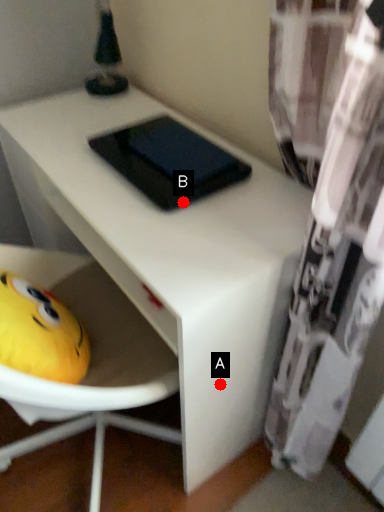
Question: Two points are circled on the image, labeled by A and B beside each circle. Which of the following is the farthest from the observer?

Choices:
 (A) A is further
 (B) B is further

Answer: (A)